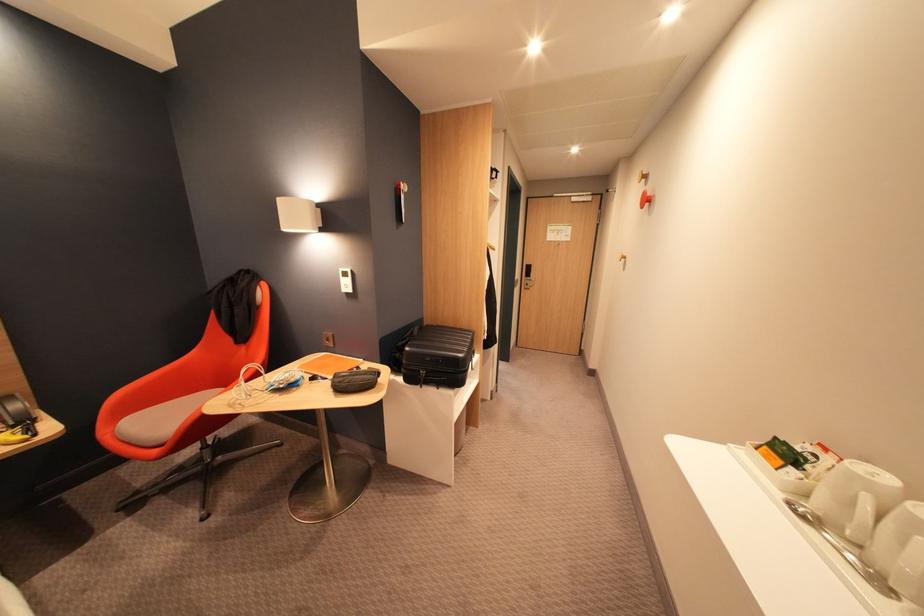
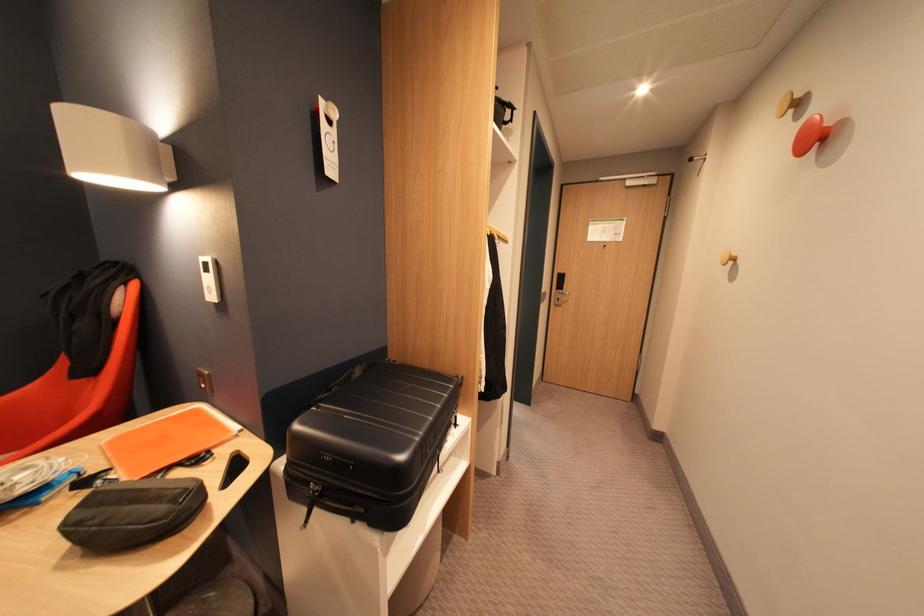
Question: How did the camera likely rotate?

Choices:
 (A) Left
 (B) Right
 (C) Up
 (D) Down

Answer: (A)